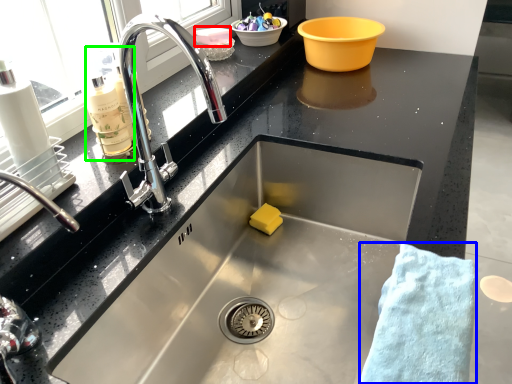
Question: Which object is the closest to the food (highlighted by a red box)? Choose among these: bath towel (highlighted by a blue box) or cleaning product (highlighted by a green box).

Choices:
 (A) bath towel
 (B) cleaning product

Answer: (B)